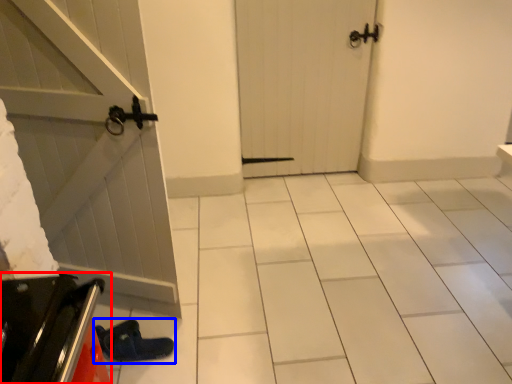
Question: Which point is further to the camera, appliance (highlighted by a red box) or footwear (highlighted by a blue box)?

Choices:
 (A) appliance
 (B) footwear

Answer: (B)